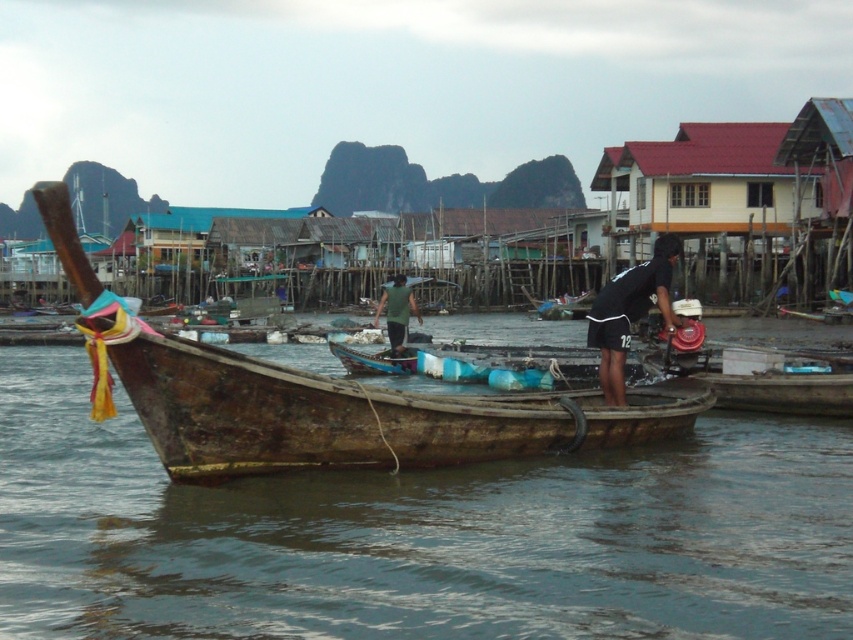
You are standing on the wooden longtail boat and looking towards the stilt houses. There are two points marked on the water surface in front of you. The first point is at coordinates point (497,436) and the second point is at coordinates point (589,330). Which point is closer to you?

Point (497,436) is in front of point (589,330), so the first point is closer to you.

You are a photographer planning to capture the rusty wood boat at center and the black fabric shirt at center in a single frame. Given the camera you have can only focus on objects within a 1.5 meter width, will both objects fit in the frame?

The rusty wood boat at center is narrower than the black fabric shirt at center. Since the camera can focus on objects within a 1.5 meter width, both objects will fit in the frame as long as their combined width does not exceed 1.5 meters. However, the exact fit depends on their individual widths and positioning.